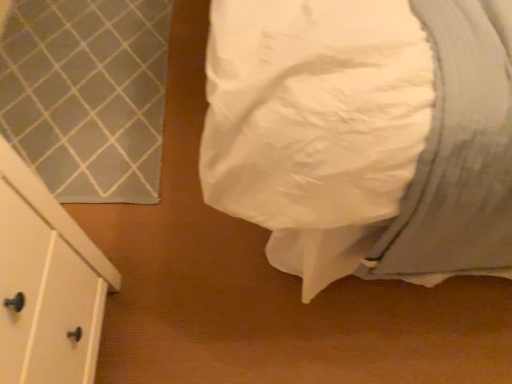
Question: Should I look upward or downward to see white smooth bedsheet at right?

Choices:
 (A) up
 (B) down

Answer: (A)